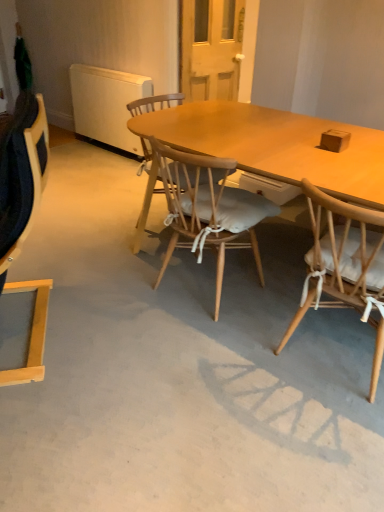
This screenshot has height=512, width=384. Identify the location of vacant space that's between light wood chair at left, marked as the third chair in a right-to-left arrangement, and wooden chair with cushion at center, acting as the second chair starting from the right. (120, 308).